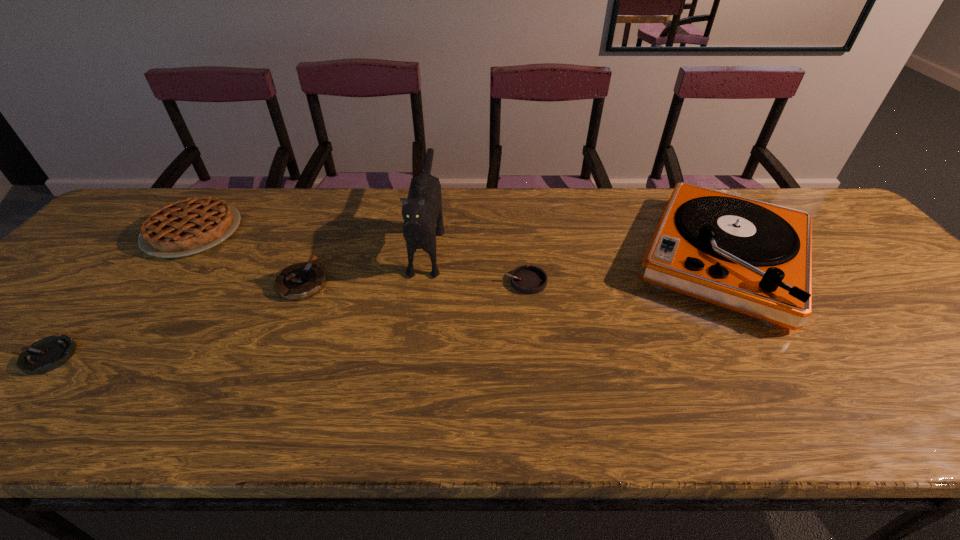
At what (x,y) coordinates should I click in order to perform the action: click on ashtray that stands as the second closest to the tallest object. Please return your answer as a coordinate pair (x, y). Image resolution: width=960 pixels, height=540 pixels. Looking at the image, I should click on (303, 280).

The image size is (960, 540). I want to click on ashtray that stands as the third closest to the third tallest object, so click(525, 279).

Locate an element on the screen. vacant area in the image that satisfies the following two spatial constraints: 1. on the front side of the fifth shortest object; 2. on the right side of the fourth shortest object is located at coordinates (173, 258).

The height and width of the screenshot is (540, 960). Identify the location of vacant space that satisfies the following two spatial constraints: 1. on the back side of the second object from right to left; 2. on the left side of the nearest object. (114, 281).

Identify the location of free point that satisfies the following two spatial constraints: 1. on the front-facing side of the cat; 2. on the right side of the fifth tallest object. (422, 281).